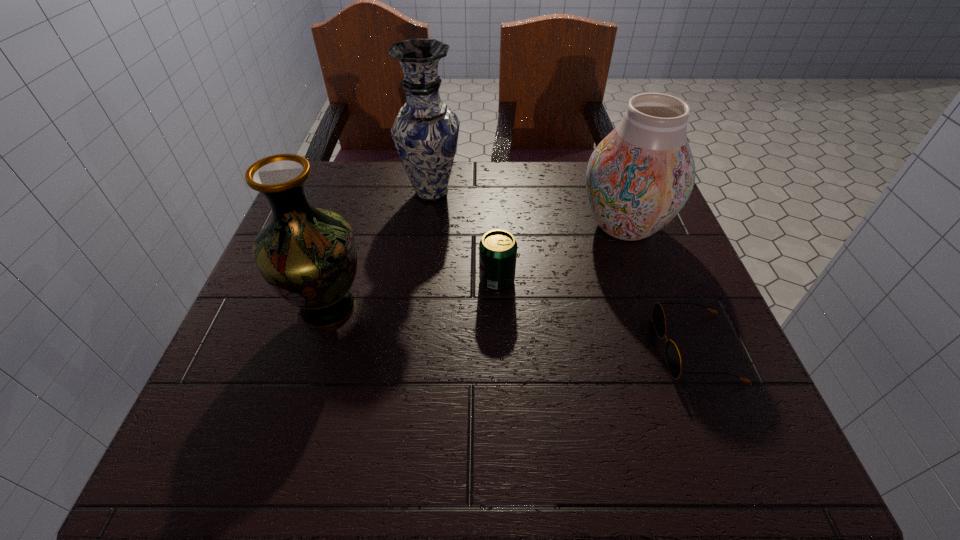
Image resolution: width=960 pixels, height=540 pixels. What are the coordinates of `the second vase from left to right` in the screenshot? It's located at (425, 133).

This screenshot has height=540, width=960. I want to click on the nearest vase, so click(x=307, y=255).

At what (x,y) coordinates should I click in order to perform the action: click on the leftmost object. Please return your answer as a coordinate pair (x, y). Looking at the image, I should click on (307, 255).

You are a GUI agent. You are given a task and a screenshot of the screen. Output one action in this format:
    pyautogui.click(x=<x>, y=<y>)
    Task: Click on the rightmost vase
    This screenshot has height=540, width=960.
    Given the screenshot: What is the action you would take?
    pyautogui.click(x=639, y=177)

Locate an element on the screen. The height and width of the screenshot is (540, 960). the fourth tallest object is located at coordinates (498, 248).

Find the location of a particular element. The width and height of the screenshot is (960, 540). beer can is located at coordinates (498, 248).

This screenshot has width=960, height=540. In order to click on the shortest object in this screenshot , I will do `click(672, 354)`.

Image resolution: width=960 pixels, height=540 pixels. I want to click on vacant space located 0.170m on the right of the second vase from right to left, so click(x=528, y=193).

In order to click on free spot located on the front of the leftmost object in this screenshot , I will do `click(300, 396)`.

Locate an element on the screen. This screenshot has height=540, width=960. vacant area situated on the front of the rightmost vase is located at coordinates (653, 308).